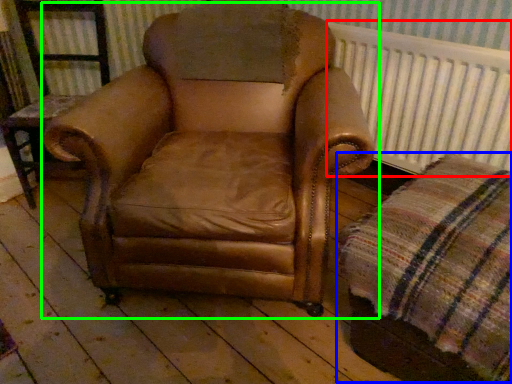
Question: Which object is positioned farthest from radiator (highlighted by a red box)? Select from plaid (highlighted by a blue box) and chair (highlighted by a green box).

Choices:
 (A) plaid
 (B) chair

Answer: (A)